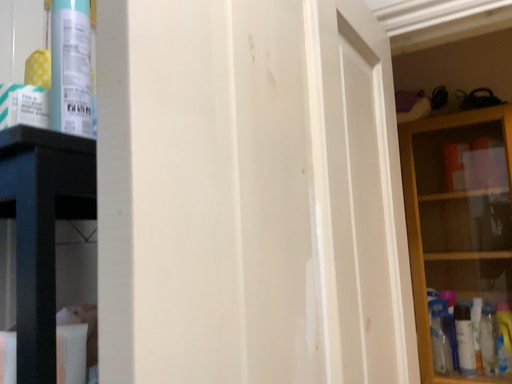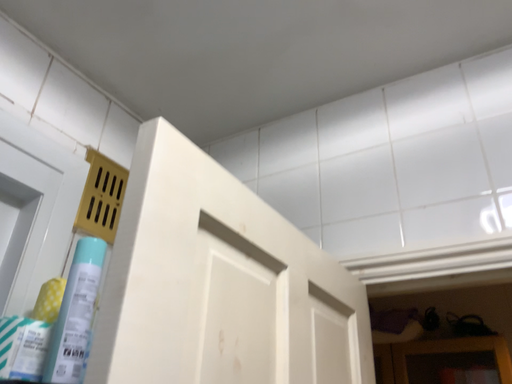
Question: How did the camera likely rotate when shooting the video?

Choices:
 (A) rotated upward
 (B) rotated downward

Answer: (A)